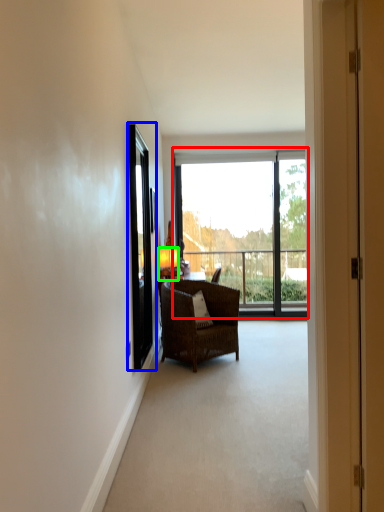
Question: Which object is positioned closest to window (highlighted by a red box)? Select from screen door (highlighted by a blue box) and lamp (highlighted by a green box).

Choices:
 (A) screen door
 (B) lamp

Answer: (B)